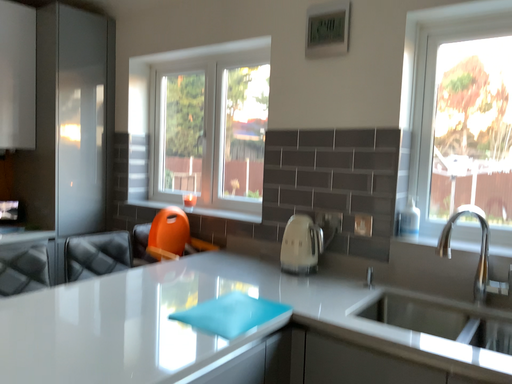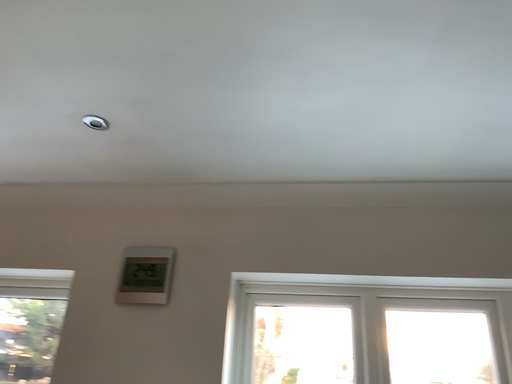
Question: How did the camera likely rotate when shooting the video?

Choices:
 (A) rotated left
 (B) rotated right

Answer: (B)